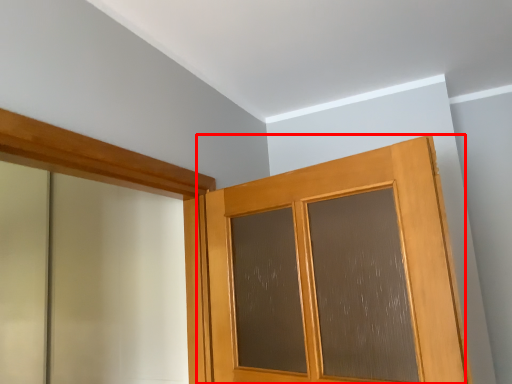
Question: Where is door (annotated by the red box) located in relation to barn door in the image?

Choices:
 (A) right
 (B) left

Answer: (A)